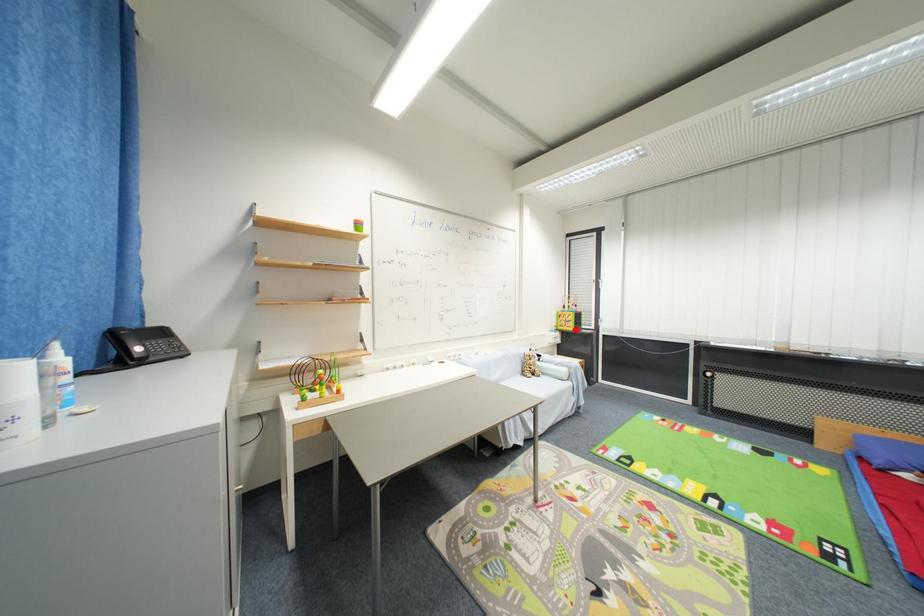
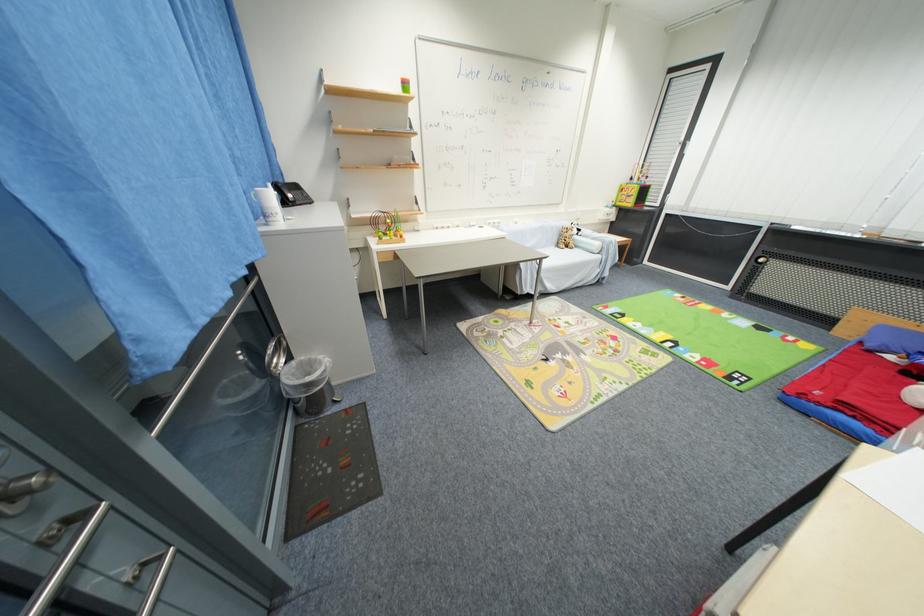
Find the pixel in the second image that matches the highlighted location in the first image.

(635, 206)